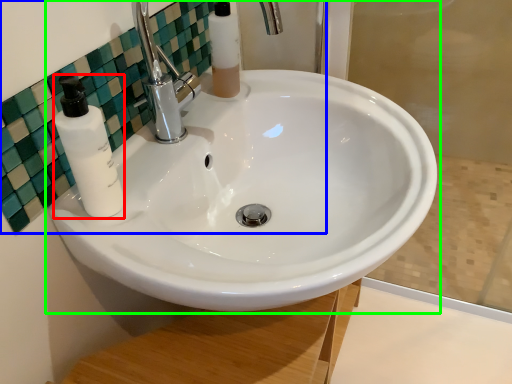
Question: Estimate the real-world distances between objects in this image. Which object is closer to soap dispenser (highlighted by a red box), mirror (highlighted by a blue box) or sink (highlighted by a green box)?

Choices:
 (A) mirror
 (B) sink

Answer: (A)